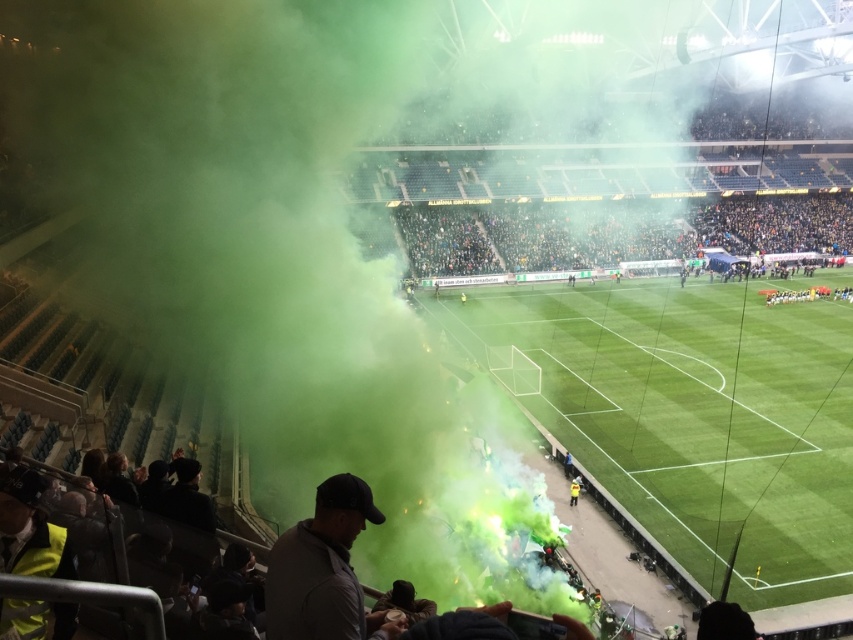
Question: Does green smoke at left appear on the right side of green grass football field at center?

Choices:
 (A) yes
 (B) no

Answer: (B)

Question: Can you confirm if green smoke at left is smaller than green grass football field at center?

Choices:
 (A) yes
 (B) no

Answer: (B)

Question: Is green smoke at left bigger than green grass football field at center?

Choices:
 (A) yes
 (B) no

Answer: (A)